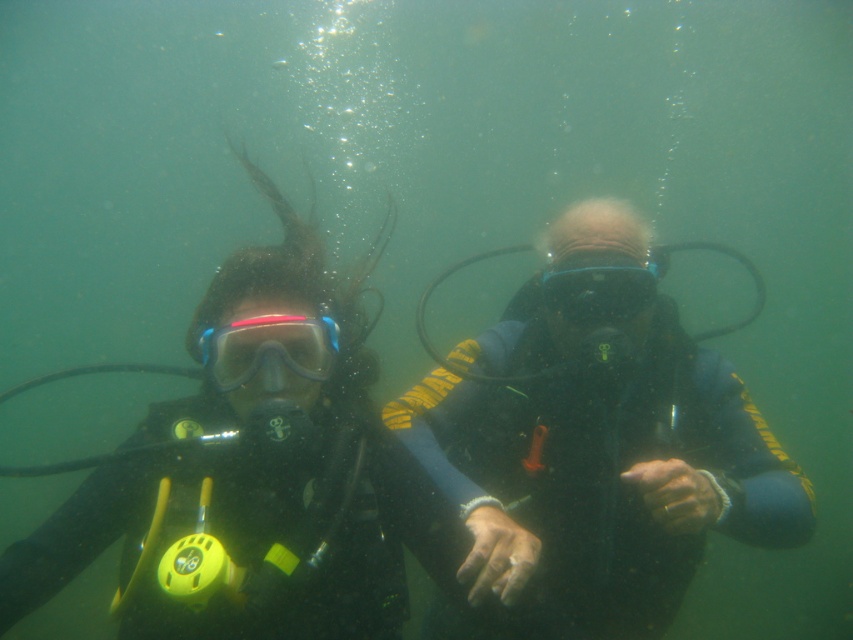
Between blue matte scuba mask at center and transparent rubber goggles at center, which one has more height?

transparent rubber goggles at center

Which is in front, point (305, 356) or point (619, 300)?

Point (305, 356)

Where is `blue matte scuba mask at center`? The height and width of the screenshot is (640, 853). blue matte scuba mask at center is located at coordinates (270, 349).

Does black rubber wetsuit at center appear on the right side of blue matte scuba mask at center?

Yes, black rubber wetsuit at center is to the right of blue matte scuba mask at center.

Who is more forward, [567,528] or [325,364]?

Point [325,364] is in front.

I want to click on black rubber wetsuit at center, so click(599, 448).

Between point (498, 436) and point (543, 282), which one is positioned in front?

Positioned in front is point (543, 282).

Who is lower down, black rubber wetsuit at center or transparent rubber goggles at center?

Positioned lower is black rubber wetsuit at center.

Is point (518, 556) farther from camera compared to point (579, 273)?

No, it is not.

Find the location of a particular element. black rubber wetsuit at center is located at coordinates (599, 448).